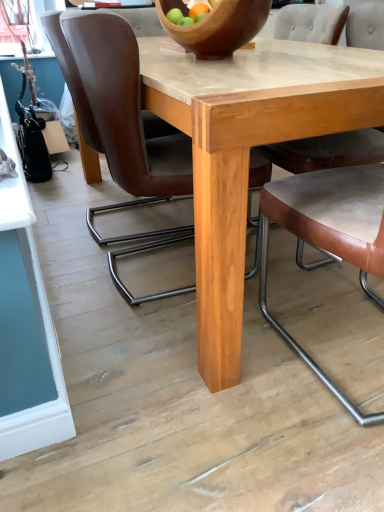
Question: Choose the correct answer: Is brown leather chair at center, marked as the 4th chair in a left-to-right arrangement, inside brown leather chair at center, which ranks as the fourth chair in right-to-left order, or outside it?

Choices:
 (A) inside
 (B) outside

Answer: (B)

Question: Is brown leather chair at center, marked as the 4th chair in a left-to-right arrangement, taller or shorter than brown leather chair at center, which ranks as the fourth chair in right-to-left order?

Choices:
 (A) tall
 (B) short

Answer: (A)

Question: Which object is the closest to the natural wood table at center?

Choices:
 (A) wooden bowl at center
 (B) brown leather chair at center, which is counted as the second chair, starting from the right
 (C) brown leather chair at center, acting as the 1th chair starting from the right
 (D) brown leather chair at center, which ranks as the fourth chair in right-to-left order
 (E) brown leather chair at center, acting as the 2th chair starting from the left

Answer: (B)

Question: Which object is positioned closest to the brown leather chair at center, the 1th chair in the left-to-right sequence?

Choices:
 (A) brown leather chair at center, acting as the 1th chair starting from the right
 (B) brown leather chair at center, the third chair viewed from the right
 (C) natural wood table at center
 (D) brown leather chair at center, arranged as the third chair when viewed from the left
 (E) wooden bowl at center

Answer: (B)